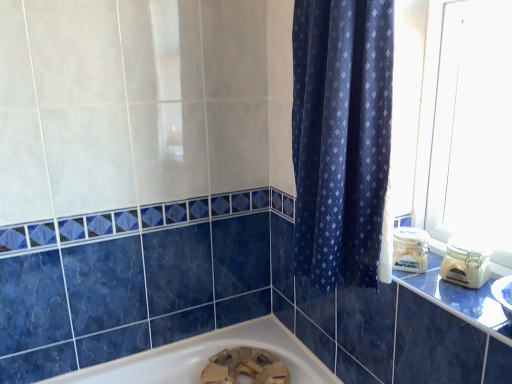
At what (x,y) coordinates should I click in order to perform the action: click on black glossy counter top at right. Please return your answer as a coordinate pair (x, y). Image resolution: width=512 pixels, height=384 pixels. Looking at the image, I should click on (459, 299).

What do you see at coordinates (459, 299) in the screenshot? I see `black glossy counter top at right` at bounding box center [459, 299].

The image size is (512, 384). Find the location of `dark blue fabric curtain at center`. dark blue fabric curtain at center is located at coordinates (341, 137).

In order to face dark blue fabric curtain at center, should I rotate leftwards or rightwards?

Rotate your view right by about 8.705°.

What do you see at coordinates (341, 137) in the screenshot? The height and width of the screenshot is (384, 512). I see `dark blue fabric curtain at center` at bounding box center [341, 137].

Where is `black glossy counter top at right`? Image resolution: width=512 pixels, height=384 pixels. black glossy counter top at right is located at coordinates (459, 299).

Can you confirm if dark blue fabric curtain at center is positioned to the right of black glossy counter top at right?

In fact, dark blue fabric curtain at center is to the left of black glossy counter top at right.

Is the depth of dark blue fabric curtain at center less than that of black glossy counter top at right?

No, it is not.

Is point (342, 105) closer or farther from the camera than point (507, 337)?

Clearly, point (342, 105) is more distant from the camera than point (507, 337).

From the image's perspective, which one is positioned lower, dark blue fabric curtain at center or black glossy counter top at right?

black glossy counter top at right is shown below in the image.

From a real-world perspective, is dark blue fabric curtain at center under black glossy counter top at right?

Incorrect, from a real-world perspective, dark blue fabric curtain at center is higher than black glossy counter top at right.

Does dark blue fabric curtain at center have a greater width compared to black glossy counter top at right?

In fact, dark blue fabric curtain at center might be narrower than black glossy counter top at right.

Consider the image. From their relative heights in the image, would you say dark blue fabric curtain at center is taller or shorter than black glossy counter top at right?

In the image, dark blue fabric curtain at center appears to be taller than black glossy counter top at right.

Between dark blue fabric curtain at center and black glossy counter top at right, which one has larger size?

dark blue fabric curtain at center is bigger.

Which is correct: dark blue fabric curtain at center is inside black glossy counter top at right, or outside of it?

dark blue fabric curtain at center is outside black glossy counter top at right.

Are dark blue fabric curtain at center and black glossy counter top at right located far from each other?

No, there isn't a large distance between dark blue fabric curtain at center and black glossy counter top at right.

Is dark blue fabric curtain at center looking in the opposite direction of black glossy counter top at right?

No, dark blue fabric curtain at center is not facing the opposite direction of black glossy counter top at right.

Can you tell me how much dark blue fabric curtain at center and black glossy counter top at right differ in facing direction?

The facing directions of dark blue fabric curtain at center and black glossy counter top at right are 0.851 degrees apart.

Locate an element on the screen. counter top that is on the right side of dark blue fabric curtain at center is located at coordinates pos(459,299).

Which object is positioned more to the right, black glossy counter top at right or dark blue fabric curtain at center?

black glossy counter top at right is more to the right.

From the picture: Does black glossy counter top at right come behind dark blue fabric curtain at center?

No, it is in front of dark blue fabric curtain at center.

Is point (413, 287) positioned behind point (382, 175)?

Yes, it is.

From the image's perspective, is black glossy counter top at right over dark blue fabric curtain at center?

No.

From a real-world perspective, between black glossy counter top at right and dark blue fabric curtain at center, who is vertically lower?

From a 3D spatial view, black glossy counter top at right is below.

Between black glossy counter top at right and dark blue fabric curtain at center, which one has smaller width?

dark blue fabric curtain at center is thinner.

In terms of height, does black glossy counter top at right look taller or shorter compared to dark blue fabric curtain at center?

black glossy counter top at right is shorter than dark blue fabric curtain at center.

Is black glossy counter top at right bigger than dark blue fabric curtain at center?

Incorrect, black glossy counter top at right is not larger than dark blue fabric curtain at center.

Choose the correct answer: Is black glossy counter top at right inside dark blue fabric curtain at center or outside it?

black glossy counter top at right lies outside dark blue fabric curtain at center.

Would you consider black glossy counter top at right to be distant from dark blue fabric curtain at center?

black glossy counter top at right is actually quite close to dark blue fabric curtain at center.

Consider the image. Is black glossy counter top at right aimed at dark blue fabric curtain at center?

No, black glossy counter top at right is not aimed at dark blue fabric curtain at center.

What's the angular difference between black glossy counter top at right and dark blue fabric curtain at center's facing directions?

0.851 degrees.

How distant is black glossy counter top at right from dark blue fabric curtain at center?

black glossy counter top at right is 32.93 centimeters away from dark blue fabric curtain at center.

Identify the location of curtain above the black glossy counter top at right (from a real-world perspective). The height and width of the screenshot is (384, 512). (341, 137).

In the image, there is a dark blue fabric curtain at center. In order to click on counter top below it (from a real-world perspective) in this screenshot , I will do `click(459, 299)`.

Find the location of a particular element. This screenshot has width=512, height=384. curtain that is on the left side of black glossy counter top at right is located at coordinates (341, 137).